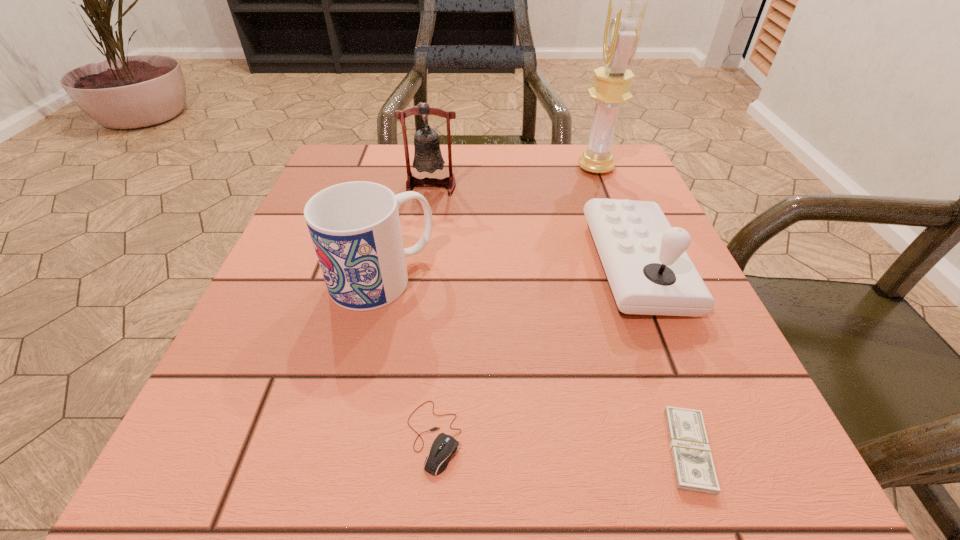
Find the location of a particular element. vacant space that satisfies the following two spatial constraints: 1. on the front-facing side of the joystick; 2. on the left side of the tallest object is located at coordinates (633, 266).

The height and width of the screenshot is (540, 960). What are the coordinates of `free location that satisfies the following two spatial constraints: 1. on the front-facing side of the tallest object; 2. on the back side of the joystick` in the screenshot? It's located at (633, 266).